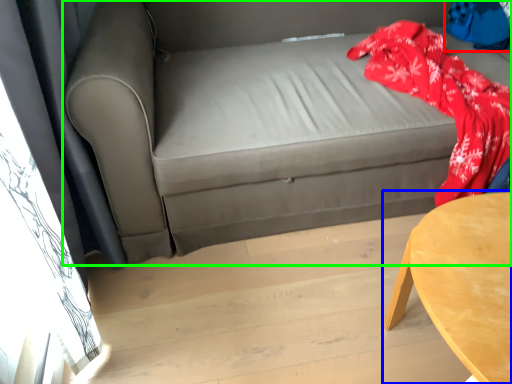
Question: Based on their relative distances, which object is farther from clothing (highlighted by a red box)? Choose from table (highlighted by a blue box) and studio couch (highlighted by a green box).

Choices:
 (A) table
 (B) studio couch

Answer: (A)